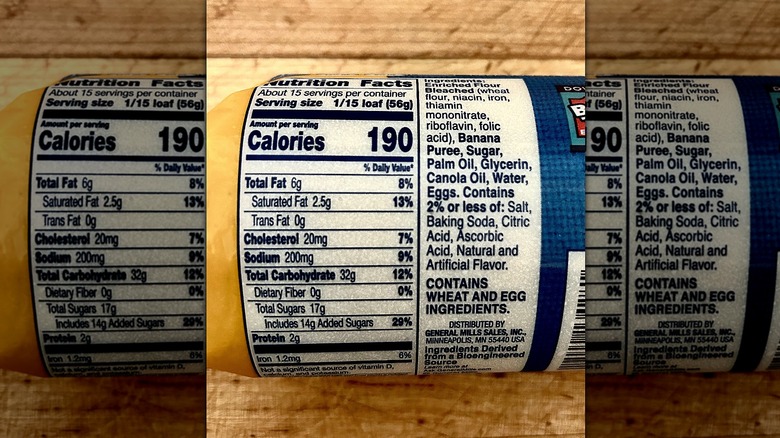
I want to click on wood plank background, so click(406, 21), click(123, 28), click(664, 30).